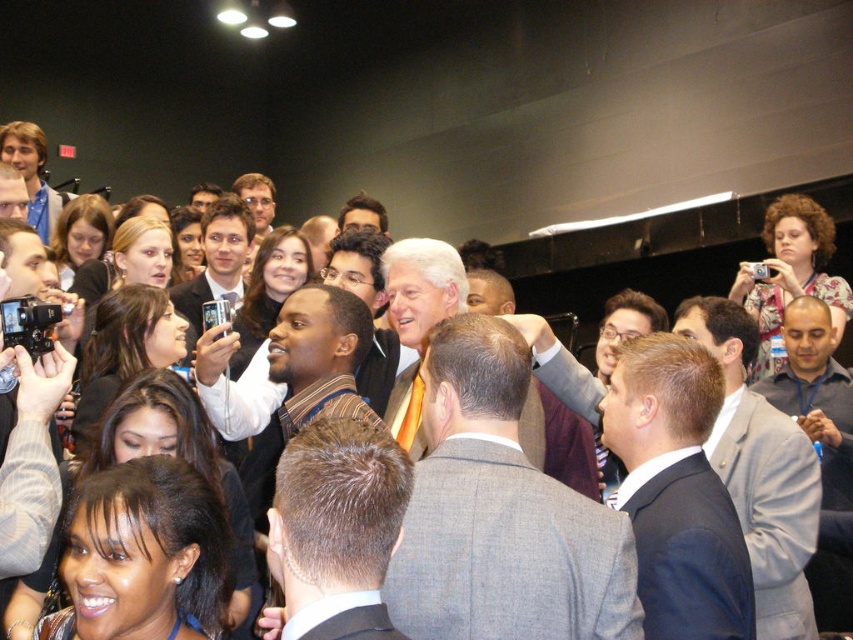
You are standing in the crowd at this event and want to take a photo of both point (343, 593) and point (238, 188) in the image. Which point should you focus on first to ensure both are in clear view?

You should focus on point (343, 593) first because it is closer to you than point (238, 188), ensuring both points are in focus when taking the photo.

In the image, there is a point labeled at coordinates (500, 513). Which object from the list corresponds to this point? The objects are the orange tie at center and the cameras and smartphones in the foreground.

The point at coordinates (500, 513) corresponds to the orange tie at center.